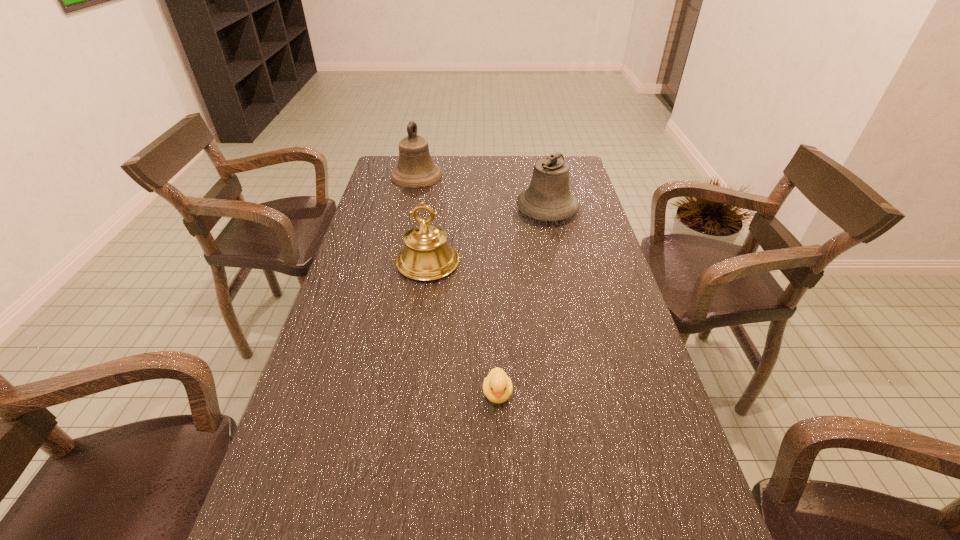
At what (x,y) coordinates should I click in order to perform the action: click on object that is at the far edge. Please return your answer as a coordinate pair (x, y). Looking at the image, I should click on (415, 169).

What are the coordinates of `object at the right edge` in the screenshot? It's located at click(x=548, y=198).

The width and height of the screenshot is (960, 540). Identify the location of object present at the far left corner. (415, 169).

In order to click on vacant area at the far edge of the desktop in this screenshot , I will do `click(464, 157)`.

In order to click on vacant space at the left edge in this screenshot , I will do `click(378, 210)`.

At what (x,y) coordinates should I click in order to perform the action: click on free location at the right edge of the desktop. Please return your answer as a coordinate pair (x, y). The width and height of the screenshot is (960, 540). Looking at the image, I should click on (610, 466).

I want to click on vacant space at the far left corner, so click(x=389, y=163).

Locate an element on the screen. This screenshot has width=960, height=540. free spot between the shortest object and the second nearest bell is located at coordinates (522, 301).

At what (x,y) coordinates should I click in order to perform the action: click on free space between the farthest object and the second farthest bell. Please return your answer as a coordinate pair (x, y). This screenshot has height=540, width=960. Looking at the image, I should click on (482, 193).

Find the location of a particular element. empty location between the farthest object and the shortest object is located at coordinates (457, 285).